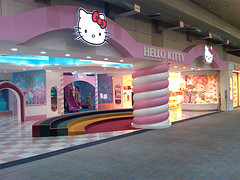
Where is `black threshold between rug and store floor`? Image resolution: width=240 pixels, height=180 pixels. black threshold between rug and store floor is located at coordinates (93, 144), (197, 116).